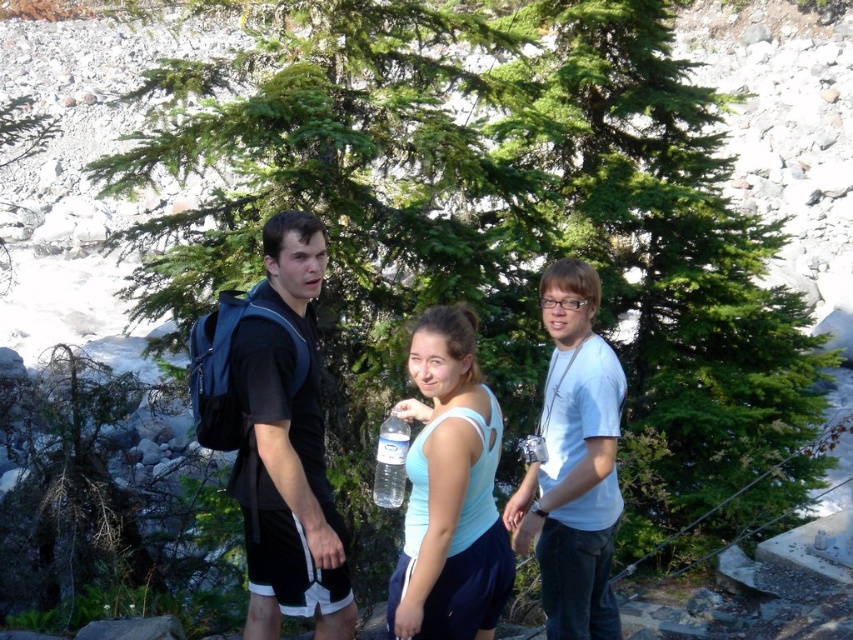
Which is above, light blue fabric tank top at center or white matte shirt at center?

light blue fabric tank top at center is above.

Based on the photo, does light blue fabric tank top at center have a lesser width compared to white matte shirt at center?

Yes.

Which is behind, point (401, 406) or point (596, 586)?

Positioned behind is point (401, 406).

Image resolution: width=853 pixels, height=640 pixels. Find the location of `light blue fabric tank top at center`. light blue fabric tank top at center is located at coordinates (450, 492).

Looking at this image, does black matte backpack at left appear under white matte shirt at center?

No.

Which of these two, black matte backpack at left or white matte shirt at center, stands taller?

Standing taller between the two is black matte backpack at left.

Between point (292, 589) and point (544, 627), which one is positioned in front?

Point (292, 589)

This screenshot has width=853, height=640. I want to click on black matte backpack at left, so click(286, 445).

In the scene shown: Is white matte shirt at center taller than clear plastic bottle at center?

Yes, white matte shirt at center is taller than clear plastic bottle at center.

Is point (573, 380) in front of point (381, 476)?

That is True.

Find the location of a particular element. The height and width of the screenshot is (640, 853). white matte shirt at center is located at coordinates (573, 461).